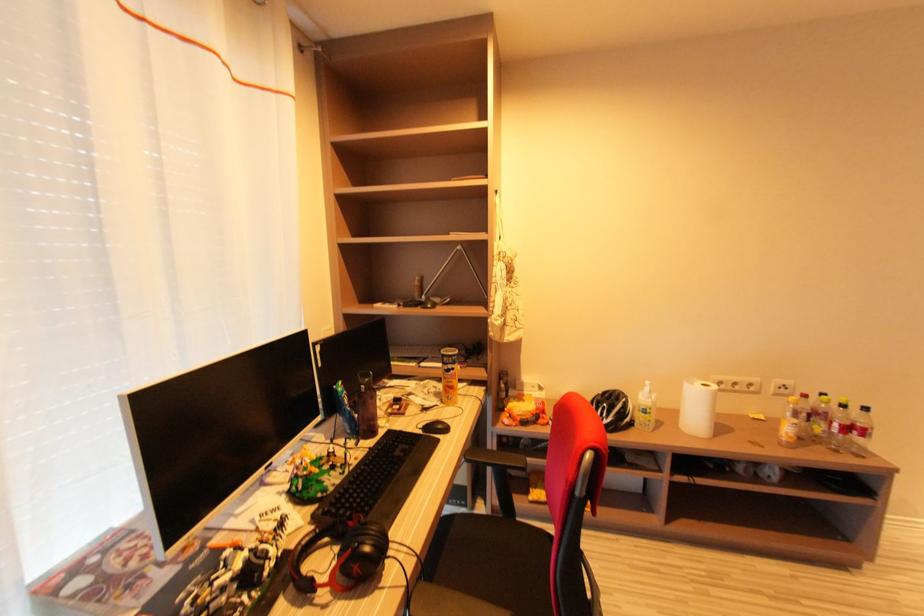
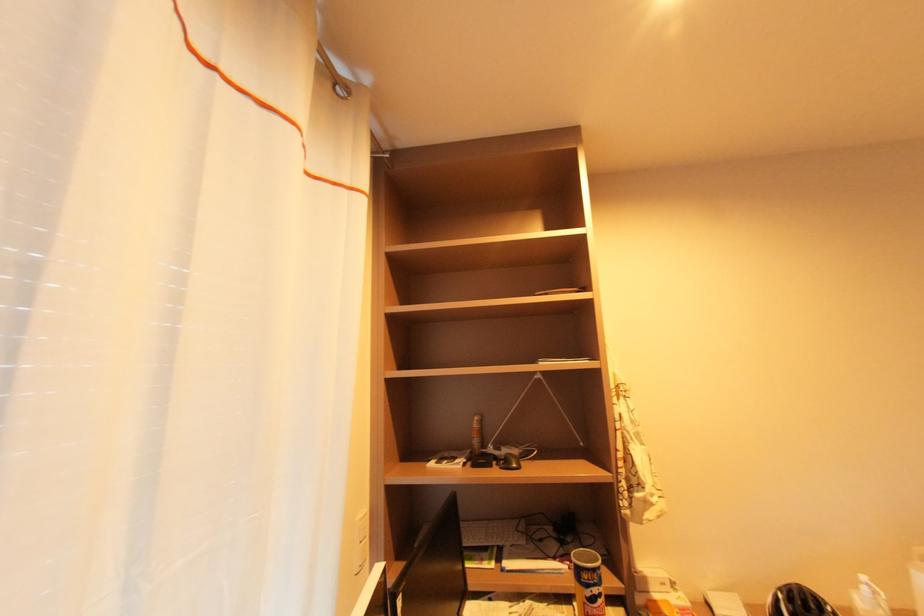
Which direction would the cameraman need to move to produce the second image?

The cameraman moved toward left, forward.